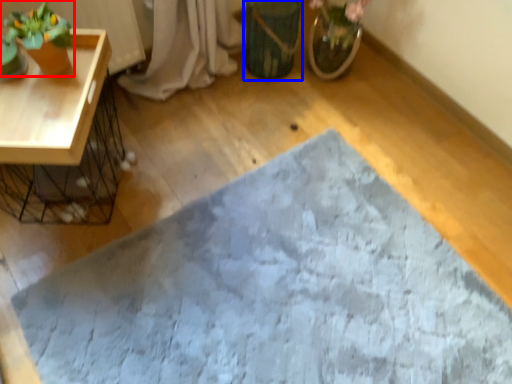
Question: Which object is further to the camera taking this photo, houseplant (highlighted by a red box) or flowerpot (highlighted by a blue box)?

Choices:
 (A) houseplant
 (B) flowerpot

Answer: (B)